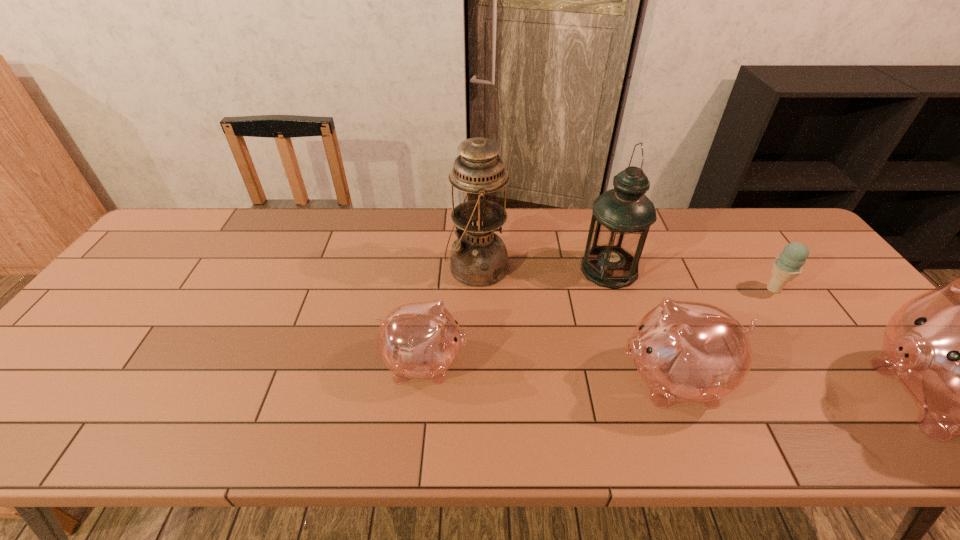
At what (x,y) coordinates should I click in order to perform the action: click on the shortest piggy bank. Please return your answer as a coordinate pair (x, y). This screenshot has height=540, width=960. Looking at the image, I should click on (422, 340).

This screenshot has width=960, height=540. What are the coordinates of `the third shortest object` in the screenshot? It's located at (685, 351).

You are a GUI agent. You are given a task and a screenshot of the screen. Output one action in this format:
    pyautogui.click(x=<x>, y=<y>)
    Task: Click on the second piggy bank from right to left
    
    Given the screenshot: What is the action you would take?
    pyautogui.click(x=685, y=351)

Where is `the left oil lamp`? The image size is (960, 540). the left oil lamp is located at coordinates (479, 258).

At what (x,y) coordinates should I click in order to perform the action: click on the right oil lamp. Please return your answer as a coordinate pair (x, y). Image resolution: width=960 pixels, height=540 pixels. Looking at the image, I should click on (621, 218).

Find the location of `ice cream`. ice cream is located at coordinates (788, 265).

Find the location of a particular element. This screenshot has width=960, height=540. vacant space located 0.360m on the front facing side of the leftmost piggy bank is located at coordinates (618, 363).

At what (x,y) coordinates should I click in order to perform the action: click on free space located on the front facing side of the third shortest object. Please return your answer as a coordinate pair (x, y). Looking at the image, I should click on (591, 380).

Where is `vacant space located 0.100m on the front facing side of the third shortest object`? This screenshot has height=540, width=960. vacant space located 0.100m on the front facing side of the third shortest object is located at coordinates (574, 380).

The image size is (960, 540). I want to click on vacant region located on the front facing side of the third shortest object, so click(x=583, y=380).